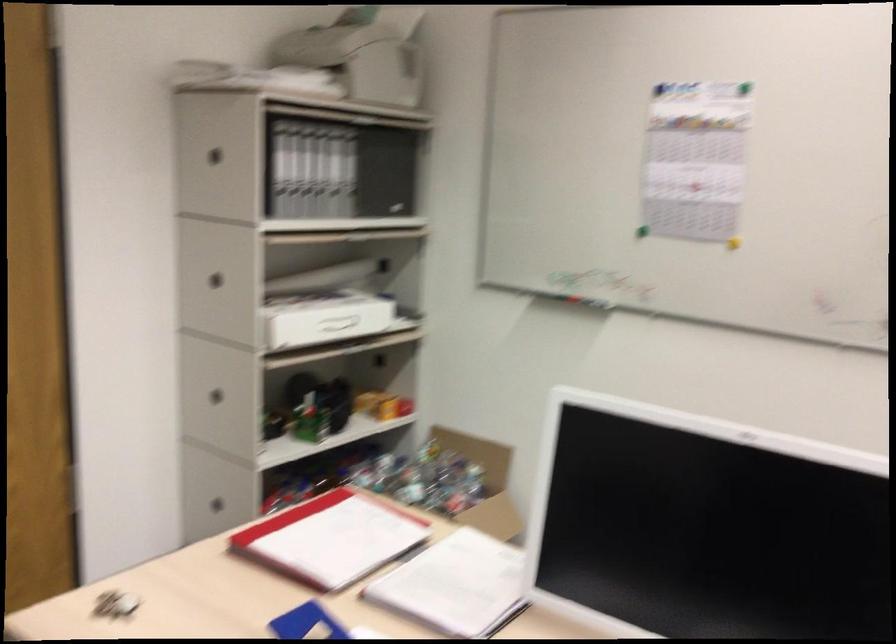
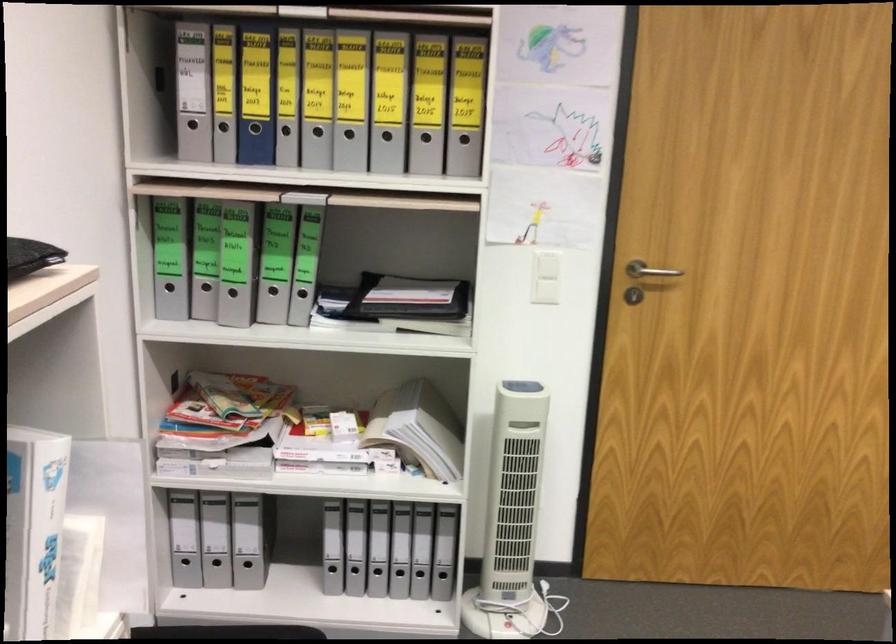
Question: How did the camera likely rotate?

Choices:
 (A) Left
 (B) Right
 (C) Up
 (D) Down

Answer: (A)